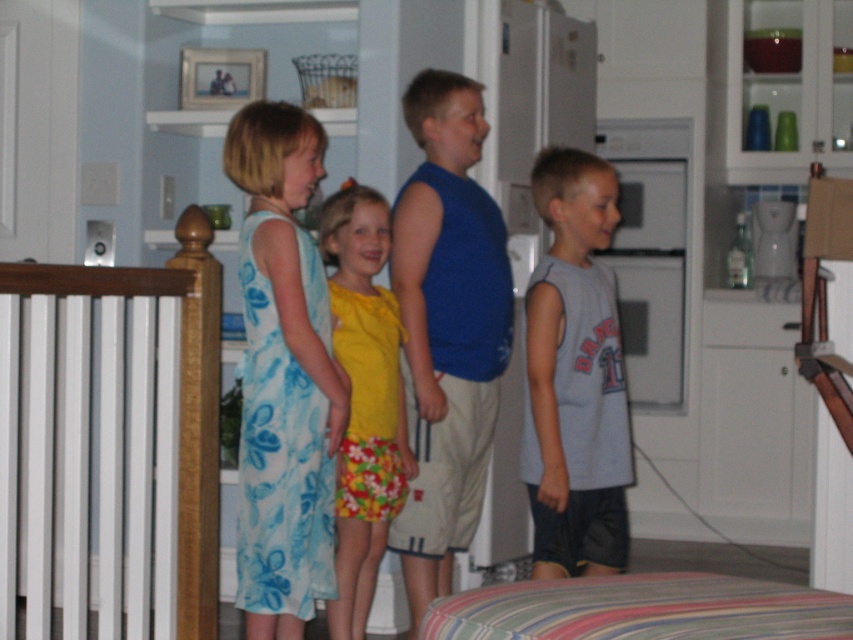
Which is more to the left, white wooden balustrade at left or gray cotton shirt at center?

Positioned to the left is white wooden balustrade at left.

Is white wooden balustrade at left positioned behind gray cotton shirt at center?

Yes.

Find the location of a particular element. This screenshot has width=853, height=640. white wooden balustrade at left is located at coordinates (109, 445).

Does blue floral dress at left have a greater height compared to gray cotton shirt at center?

Yes, blue floral dress at left is taller than gray cotton shirt at center.

Image resolution: width=853 pixels, height=640 pixels. What do you see at coordinates (447, 321) in the screenshot? I see `blue floral dress at left` at bounding box center [447, 321].

Where is `blue floral dress at left`? blue floral dress at left is located at coordinates (447, 321).

Who is positioned more to the right, blue floral dress at left or yellow fabric dress at center?

blue floral dress at left is more to the right.

From the picture: Is blue floral dress at left positioned in front of yellow fabric dress at center?

No, it is not.

Between point (457, 317) and point (403, 458), which one is positioned in front?

Point (403, 458)

Locate an element on the screen. This screenshot has height=640, width=853. blue floral dress at left is located at coordinates (447, 321).